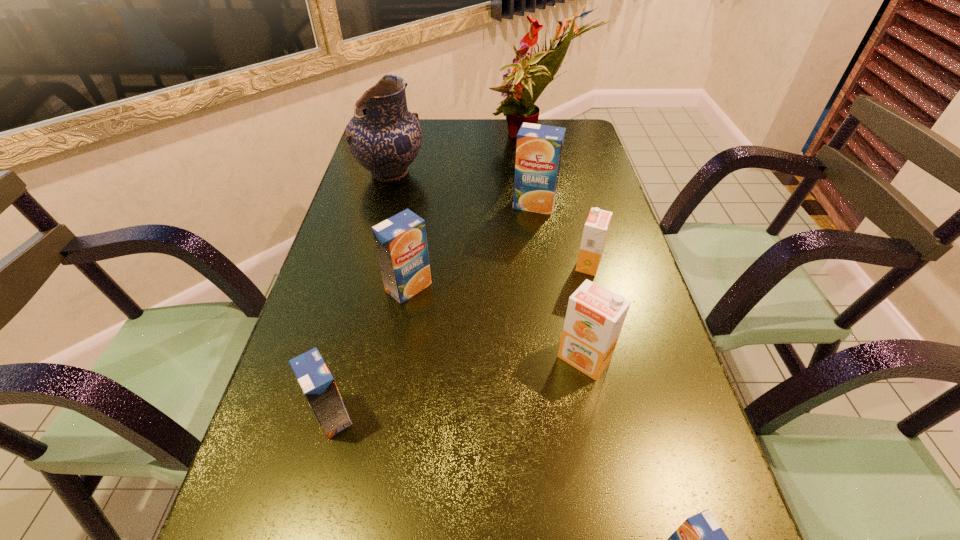
This screenshot has width=960, height=540. I want to click on free space located 0.280m on the front of the farther orange orange juice, so click(618, 383).

The height and width of the screenshot is (540, 960). What are the coordinates of `object that is at the far edge` in the screenshot? It's located at point(519,106).

Where is `pottery that is at the left edge`? This screenshot has height=540, width=960. pottery that is at the left edge is located at coordinates (384, 137).

At what (x,y) coordinates should I click in order to perform the action: click on bouquet positioned at the right edge. Please return your answer as a coordinate pair (x, y). Looking at the image, I should click on (519, 106).

Identify the location of object located at the far right corner. This screenshot has height=540, width=960. (519, 106).

You are a GUI agent. You are given a task and a screenshot of the screen. Output one action in this format:
    pyautogui.click(x=<x>, y=<y>)
    Task: Click on the free region at the far edge of the desktop
    This screenshot has width=960, height=540.
    Given the screenshot: What is the action you would take?
    pyautogui.click(x=493, y=132)

In the image, there is a desktop. Identify the location of vacant space at the left edge. The image size is (960, 540). (344, 267).

Where is `vacant area at the right edge of the desktop`? vacant area at the right edge of the desktop is located at coordinates (637, 278).

Where is `vacant area at the far right corner of the desktop`? The image size is (960, 540). vacant area at the far right corner of the desktop is located at coordinates (559, 126).

The height and width of the screenshot is (540, 960). I want to click on empty space between the tallest object and the nearer orange orange juice, so click(x=560, y=249).